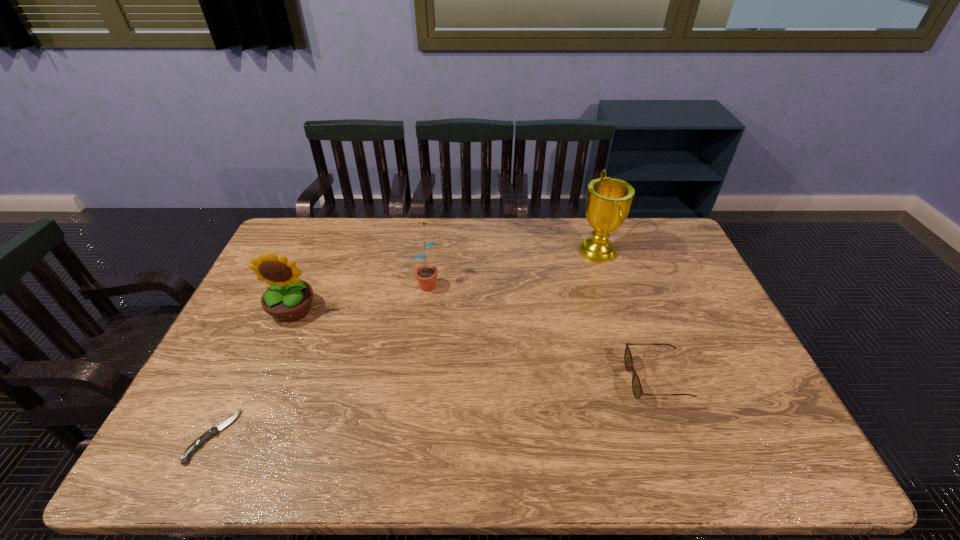
This screenshot has width=960, height=540. I want to click on free spot that satisfies the following two spatial constraints: 1. on the shiny surface of the award; 2. on the face of the left sunflower, so click(x=616, y=309).

Locate an element on the screen. The width and height of the screenshot is (960, 540). vacant space that satisfies the following two spatial constraints: 1. on the shiny surface of the award; 2. on the face of the left sunflower is located at coordinates (616, 309).

At what (x,y) coordinates should I click in order to perform the action: click on vacant space that satisfies the following two spatial constraints: 1. on the shiny surface of the award; 2. on the face of the left sunflower. Please return your answer as a coordinate pair (x, y). Image resolution: width=960 pixels, height=540 pixels. Looking at the image, I should click on (616, 309).

I want to click on free spot that satisfies the following two spatial constraints: 1. on the shiny surface of the award; 2. on the face of the left sunflower, so click(x=616, y=309).